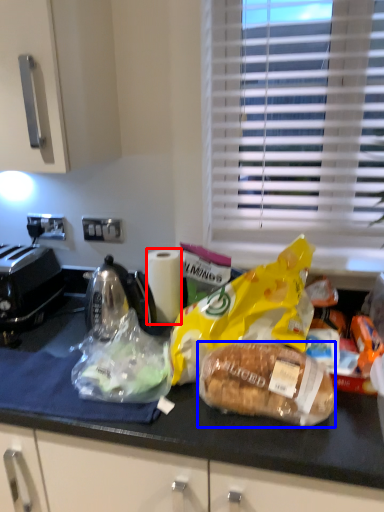
Question: Which of the following is the farthest to the observer, paper towel (highlighted by a red box) or bread (highlighted by a blue box)?

Choices:
 (A) paper towel
 (B) bread

Answer: (A)